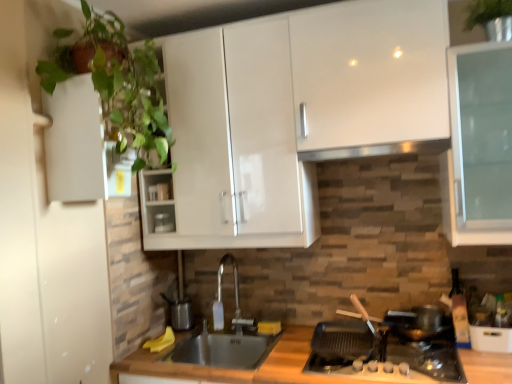
Identify the location of black glass gas stove at lower right. (401, 360).

Describe the element at coordinates (401, 360) in the screenshot. This screenshot has width=512, height=384. I see `black glass gas stove at lower right` at that location.

Find the location of `stainless steel exhaust hood at upper center`. stainless steel exhaust hood at upper center is located at coordinates (377, 150).

Find the location of a particular element. The height and width of the screenshot is (384, 512). matte white container at center is located at coordinates (163, 223).

The width and height of the screenshot is (512, 384). Find the location of `exhaust hood lying above the matte white container at center (from the image's perspective)`. exhaust hood lying above the matte white container at center (from the image's perspective) is located at coordinates (377, 150).

Considering the relative sizes of matte white container at center and stainless steel exhaust hood at upper center in the image provided, is matte white container at center taller than stainless steel exhaust hood at upper center?

Yes.

Does matte white container at center appear on the left side of stainless steel exhaust hood at upper center?

Yes.

From a real-world perspective, relative to stainless steel exhaust hood at upper center, is matte white container at center vertically above or below?

matte white container at center is situated lower than stainless steel exhaust hood at upper center in the real world.

Considering the sizes of objects matte white container at center and green leafy plant at left in the image provided, who is smaller, matte white container at center or green leafy plant at left?

Smaller between the two is matte white container at center.

Considering the relative positions of matte white container at center and green leafy plant at left in the image provided, is matte white container at center to the left or to the right of green leafy plant at left?

From the image, it's evident that matte white container at center is to the right of green leafy plant at left.

From the picture: Does matte white container at center have a lesser width compared to green leafy plant at left?

Yes.

From a real-world perspective, which object rests below the other?

matte white container at center, from a real-world perspective.

Could you tell me if black stainless steel sink at center is turned towards matte white container at center?

No, black stainless steel sink at center does not turn towards matte white container at center.

From the image's perspective, is black stainless steel sink at center located above or below matte white container at center?

Clearly, from the image's perspective, black stainless steel sink at center is below matte white container at center.

Is black stainless steel sink at center behind matte white container at center?

No, black stainless steel sink at center is closer to the camera.

Is black stainless steel sink at center wider than matte white container at center?

Yes.

At what (x,y) coordinates should I click in order to perform the action: click on plant on the left of the stainless steel exhaust hood at upper center. Please return your answer as a coordinate pair (x, y). This screenshot has width=512, height=384. Looking at the image, I should click on (118, 85).

Is green leafy plant at left positioned with its back to stainless steel exhaust hood at upper center?

No.

From the image's perspective, is green leafy plant at left above stainless steel exhaust hood at upper center?

Yes, from the image's perspective, green leafy plant at left is on top of stainless steel exhaust hood at upper center.

Which is more to the left, stainless steel exhaust hood at upper center or black stainless steel sink at center?

black stainless steel sink at center.

From the image's perspective, relative to black stainless steel sink at center, is stainless steel exhaust hood at upper center above or below?

Based on their image positions, stainless steel exhaust hood at upper center is located above black stainless steel sink at center.

Is stainless steel exhaust hood at upper center looking in the opposite direction of black stainless steel sink at center?

No, black stainless steel sink at center is not at the back of stainless steel exhaust hood at upper center.

Considering the sizes of objects green leafy plant at left and black glass gas stove at lower right in the image provided, who is wider, green leafy plant at left or black glass gas stove at lower right?

Wider between the two is black glass gas stove at lower right.

Is green leafy plant at left positioned in front of black glass gas stove at lower right?

That is True.

From a real-world perspective, is green leafy plant at left positioned under black glass gas stove at lower right based on gravity?

No, from a real-world perspective, green leafy plant at left is not under black glass gas stove at lower right.

Considering the positions of objects green leafy plant at left and matte white container at center in the image provided, who is more to the right, green leafy plant at left or matte white container at center?

matte white container at center is more to the right.

Considering the relative sizes of green leafy plant at left and matte white container at center in the image provided, is green leafy plant at left smaller than matte white container at center?

No, green leafy plant at left is not smaller than matte white container at center.

Consider the image. Does green leafy plant at left have a greater width compared to matte white container at center?

Correct, the width of green leafy plant at left exceeds that of matte white container at center.

At what (x,y) coordinates should I click in order to perform the action: click on appliance behind the stainless steel exhaust hood at upper center. Please return your answer as a coordinate pair (x, y). Looking at the image, I should click on (163, 223).

The image size is (512, 384). Find the location of `plant that appears above the matte white container at center (from the image's perspective)`. plant that appears above the matte white container at center (from the image's perspective) is located at coordinates (118, 85).

From the image, which object appears to be farther from matte white container at center, black glass gas stove at lower right or black stainless steel sink at center?

black glass gas stove at lower right.

Looking at the image, which one is located closer to black glass gas stove at lower right, matte white container at center or green leafy plant at left?

matte white container at center is positioned closer to the anchor black glass gas stove at lower right.

Estimate the real-world distances between objects in this image. Which object is closer to black stainless steel sink at center, matte white container at center or green leafy plant at left?

matte white container at center lies closer to black stainless steel sink at center than the other object.

Based on their spatial positions, is black stainless steel sink at center or matte white container at center closer to black glass gas stove at lower right?

black stainless steel sink at center is positioned closer to the anchor black glass gas stove at lower right.

Consider the image. Which object lies further to the anchor point stainless steel exhaust hood at upper center, green leafy plant at left or matte white container at center?

matte white container at center is positioned further to the anchor stainless steel exhaust hood at upper center.

Based on their spatial positions, is stainless steel exhaust hood at upper center or green leafy plant at left further from black stainless steel sink at center?

green leafy plant at left lies further to black stainless steel sink at center than the other object.

Estimate the real-world distances between objects in this image. Which object is closer to matte white container at center, black stainless steel sink at center or black glass gas stove at lower right?

Based on the image, black stainless steel sink at center appears to be nearer to matte white container at center.

Considering their positions, is black glass gas stove at lower right positioned further to matte white container at center than stainless steel exhaust hood at upper center?

black glass gas stove at lower right lies further to matte white container at center than the other object.

The image size is (512, 384). I want to click on gas stove that lies between stainless steel exhaust hood at upper center and black stainless steel sink at center from top to bottom, so click(x=401, y=360).

Locate an element on the screen. The image size is (512, 384). appliance between green leafy plant at left and stainless steel exhaust hood at upper center in the horizontal direction is located at coordinates (163, 223).

Locate an element on the screen. The width and height of the screenshot is (512, 384). exhaust hood between matte white container at center and black glass gas stove at lower right in the horizontal direction is located at coordinates (377, 150).

Locate an element on the screen. This screenshot has width=512, height=384. appliance between stainless steel exhaust hood at upper center and black stainless steel sink at center vertically is located at coordinates (163, 223).